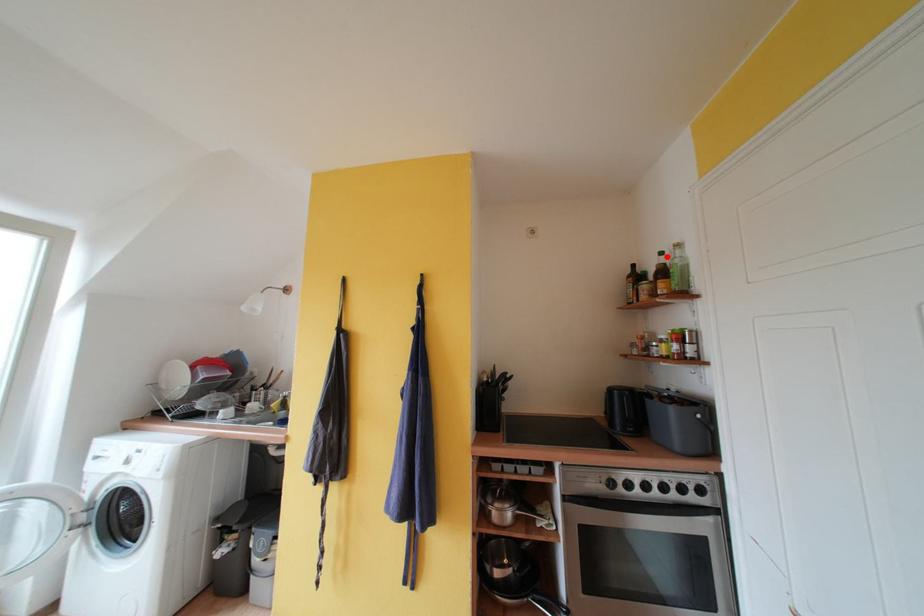
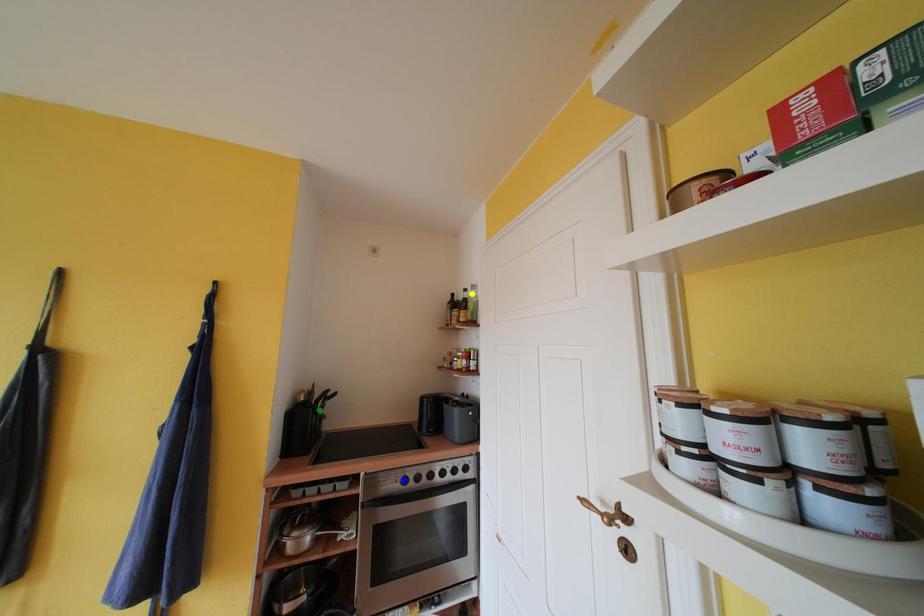
Question: I am providing you with two images of the same scene from different viewpoints. A red point is marked on the first image. You are given multiple points on the second image. Which mark in image 2 goes with the point in image 1?

Choices:
 (A) yellow point
 (B) green point
 (C) blue point

Answer: (A)